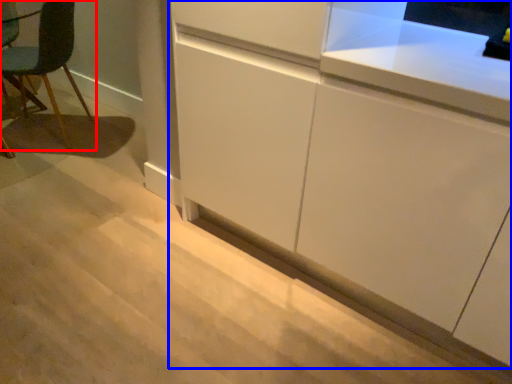
Question: Which object is further to the camera taking this photo, chair (highlighted by a red box) or cabinetry (highlighted by a blue box)?

Choices:
 (A) chair
 (B) cabinetry

Answer: (A)